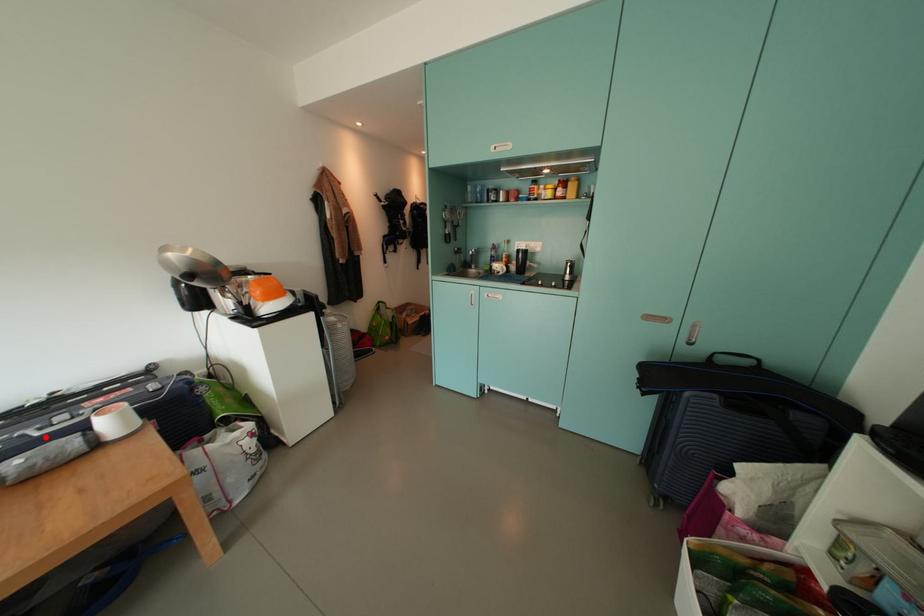
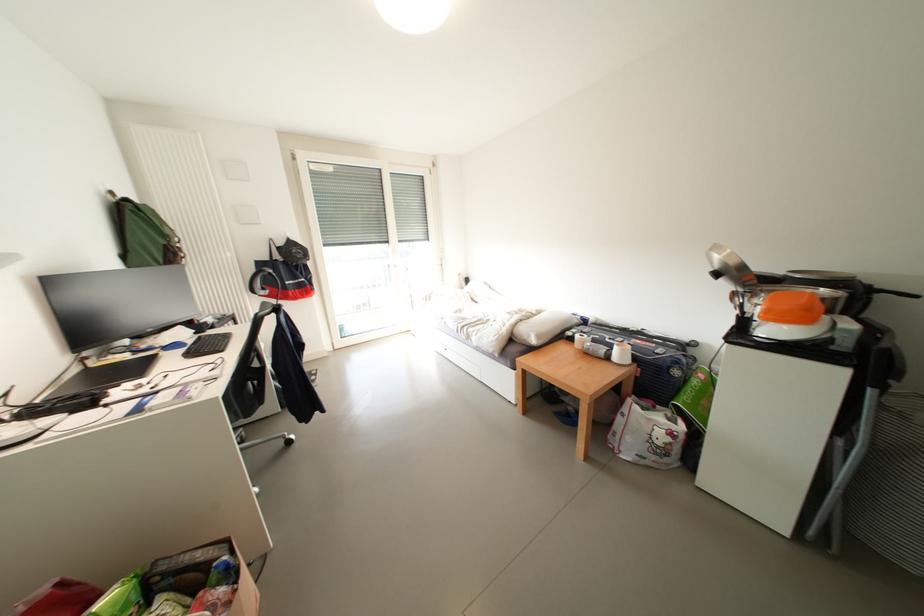
In the second image, find the point that corresponds to the highlighted location in the first image.

(614, 342)